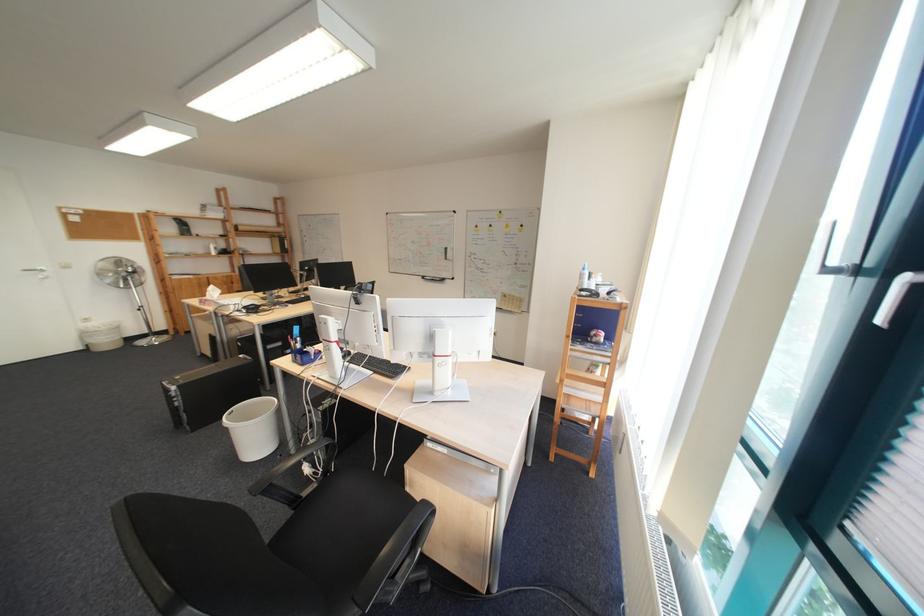
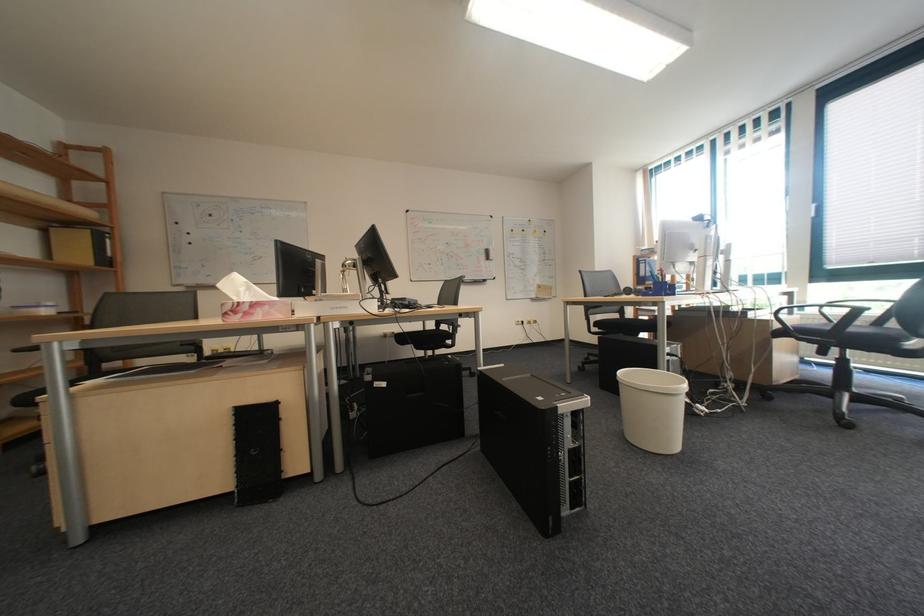
Find the pixel in the second image that matches (x=254, y=346) in the first image.

(398, 386)